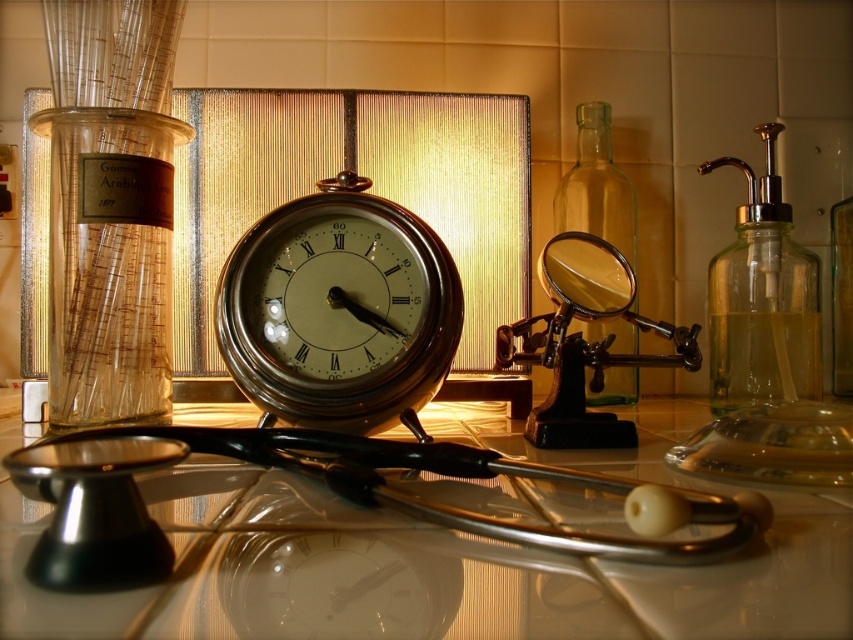
You are a medical student setting up an exhibit. You have a shiny brass clock at center and a transparent glass cylinder at left. Which object should you place closer to the edge of the table to prevent it from falling off?

The shiny brass clock at center has a smaller size compared to the transparent glass cylinder at left, so it should be placed closer to the edge of the table to prevent it from falling off because smaller objects are more stable when closer to the edge.